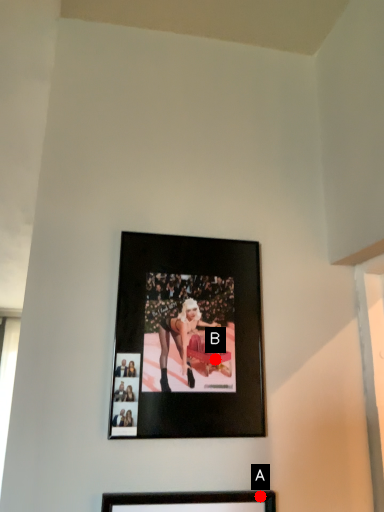
Question: Two points are circled on the image, labeled by A and B beside each circle. Among these points, which one is nearest to the camera?

Choices:
 (A) A is closer
 (B) B is closer

Answer: (A)